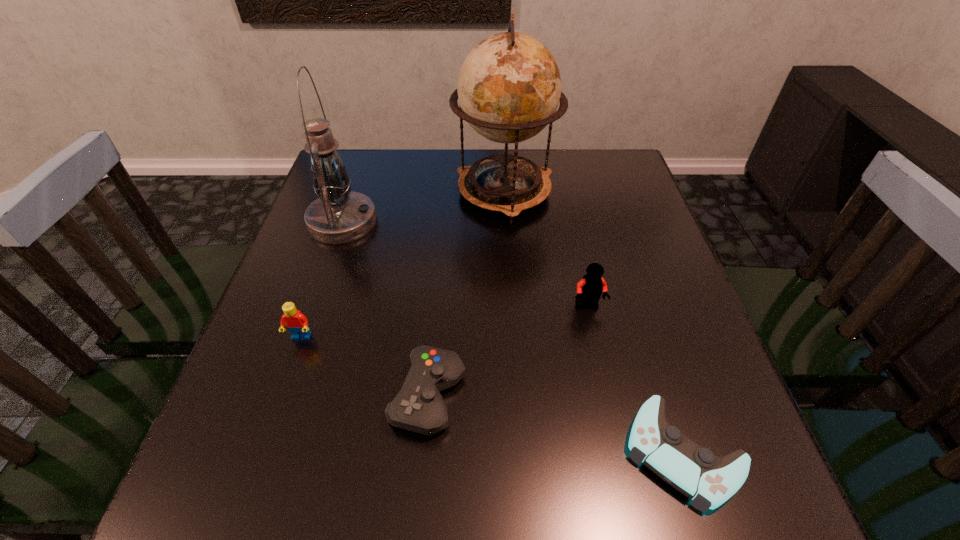
This screenshot has width=960, height=540. I want to click on vacant space that satisfies the following two spatial constraints: 1. on the front-facing side of the farther Lego; 2. on the left side of the shorter control, so click(620, 453).

The height and width of the screenshot is (540, 960). Find the location of `free spot that satisfies the following two spatial constraints: 1. on the face of the right control; 2. on the right side of the nearer Lego`. free spot that satisfies the following two spatial constraints: 1. on the face of the right control; 2. on the right side of the nearer Lego is located at coordinates (261, 453).

The image size is (960, 540). In order to click on blank space that satisfies the following two spatial constraints: 1. at the center of the globe; 2. on the right side of the shorter control in this screenshot , I will do `click(521, 453)`.